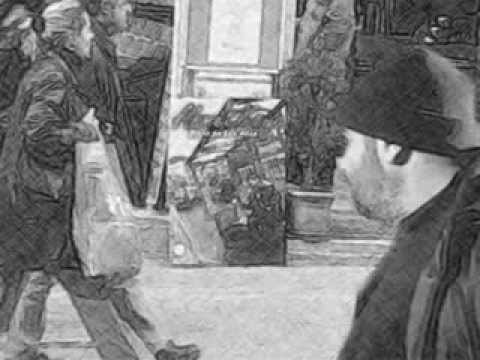
Find the location of a particular element. The width and height of the screenshot is (480, 360). plant is located at coordinates (321, 122).